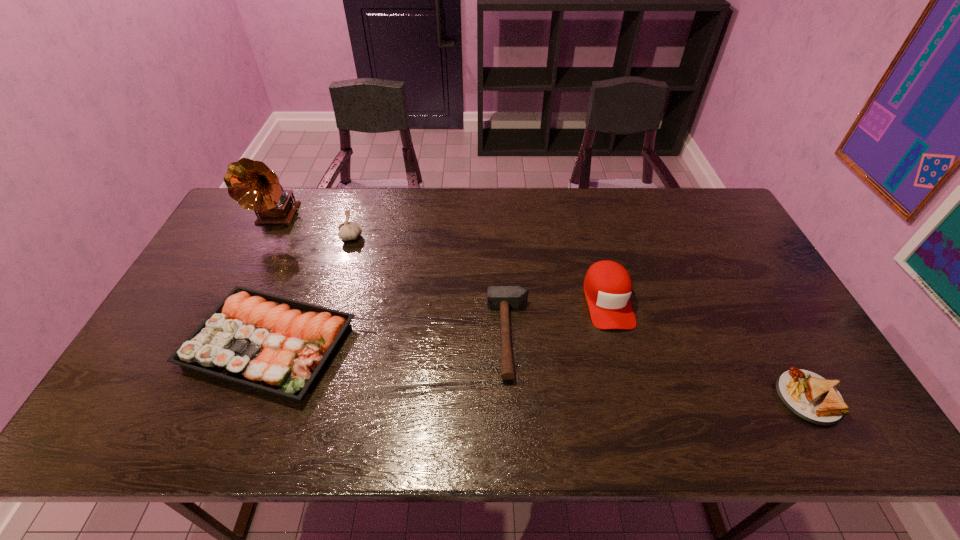
The width and height of the screenshot is (960, 540). Find the location of `phonograph_record`. phonograph_record is located at coordinates (252, 184).

This screenshot has width=960, height=540. Identify the location of garlic. (348, 230).

Locate an element on the screen. The height and width of the screenshot is (540, 960). baseball cap is located at coordinates (607, 285).

The image size is (960, 540). Find the location of `platter`. platter is located at coordinates pos(278,345).

Identify the location of the fourth object from left to right. (504, 298).

In order to click on the shortest object in this screenshot , I will do `click(809, 396)`.

At what (x,y) coordinates should I click in order to perform the action: click on sandwich. Please return your answer as a coordinate pair (x, y). Looking at the image, I should click on (x=809, y=396).

Identify the location of free space located on the horn of the tallest object. (247, 276).

Locate an element on the screen. The image size is (960, 540). vacant space located 0.180m on the front of the garlic is located at coordinates (336, 286).

Where is `vacant region located on the front-facing side of the fifth object from left to right`? The height and width of the screenshot is (540, 960). vacant region located on the front-facing side of the fifth object from left to right is located at coordinates (625, 367).